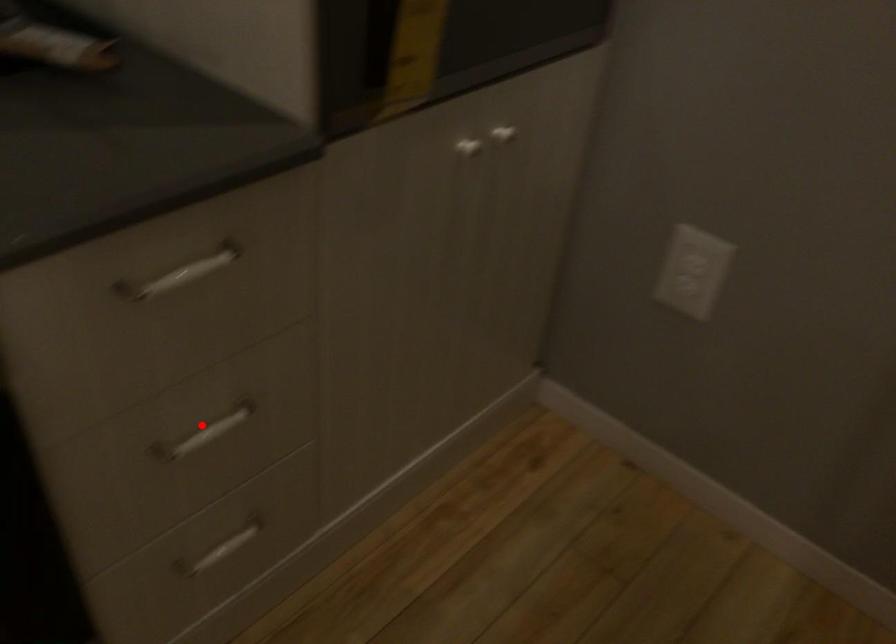
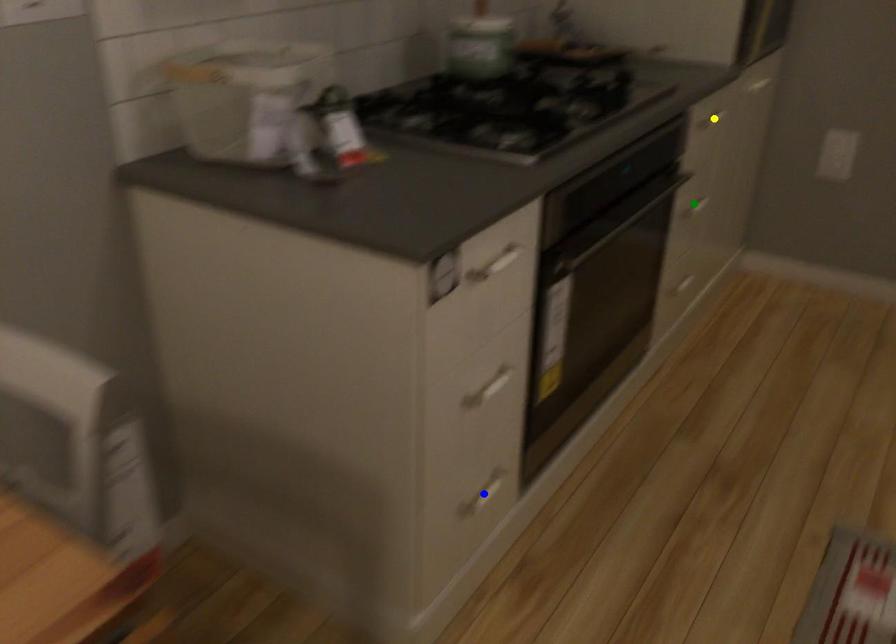
Question: I am providing you with two images of the same scene from different viewpoints. A red point is marked on the first image. You are given multiple points on the second image. In image 2, which mark is for the same physical point as the one in image 1?

Choices:
 (A) green point
 (B) blue point
 (C) yellow point

Answer: (A)